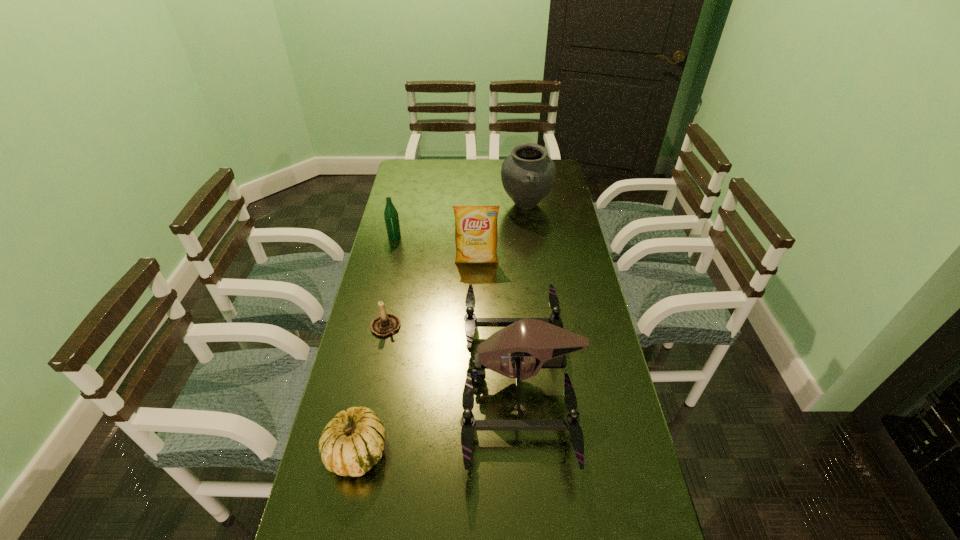
Locate an element on the screen. The image size is (960, 540). vacant region located on the front-facing side of the drone is located at coordinates (378, 379).

Image resolution: width=960 pixels, height=540 pixels. Identify the location of vacant region located 0.200m on the front-facing side of the drone. (x=393, y=379).

Identify the location of vacant area situated 0.170m on the back of the bottle. The height and width of the screenshot is (540, 960). (401, 208).

The height and width of the screenshot is (540, 960). In order to click on vacant space situated on the back of the gourd in this screenshot , I will do `click(368, 401)`.

Image resolution: width=960 pixels, height=540 pixels. Find the location of `free region located 0.330m on the front of the candle holder`. free region located 0.330m on the front of the candle holder is located at coordinates (363, 441).

Where is `bottle present at the left edge`? bottle present at the left edge is located at coordinates (391, 217).

Identify the location of gourd situated at the left edge. This screenshot has height=540, width=960. (x=351, y=443).

Find the location of a particular element. Image resolution: width=960 pixels, height=540 pixels. candle holder at the left edge is located at coordinates (386, 324).

You are a GUI agent. You are given a task and a screenshot of the screen. Output one action in this format:
    pyautogui.click(x=<x>, y=<y>)
    Task: Click on the urn at the right edge
    The image size is (960, 540).
    Given the screenshot: What is the action you would take?
    pyautogui.click(x=528, y=174)

Locate an element on the screen. drone present at the right edge is located at coordinates (525, 345).